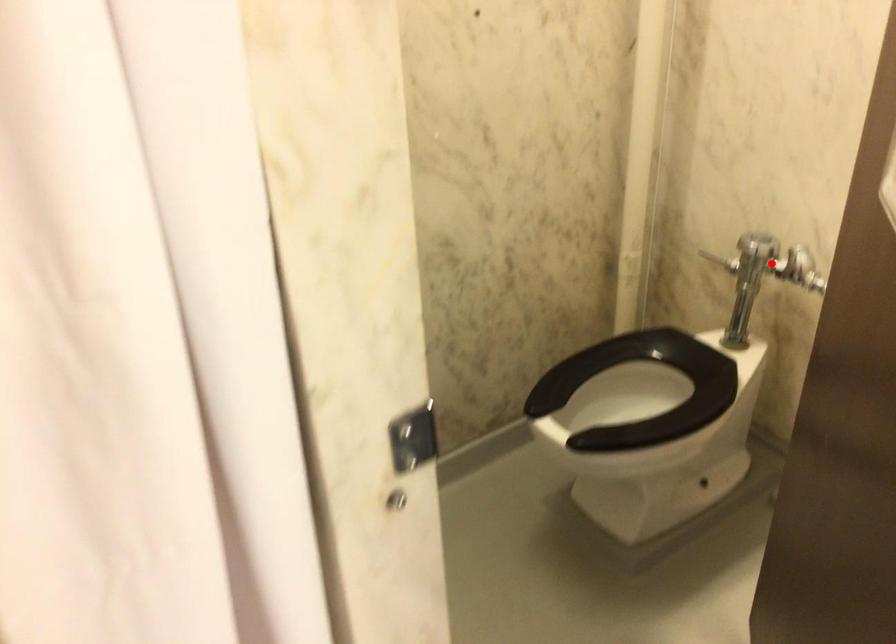
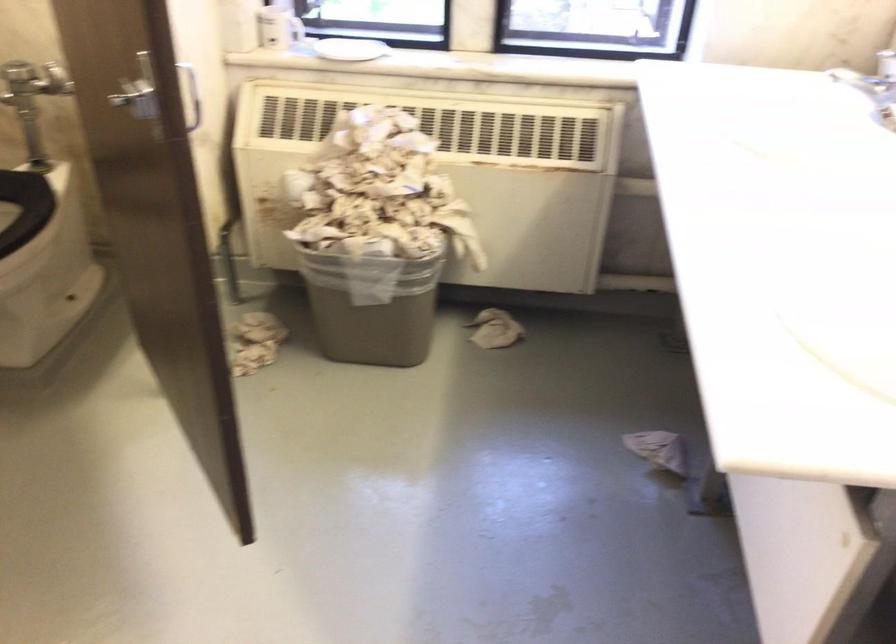
Question: I am providing you with two images of the same scene from different viewpoints. Image1 has a red point marked. In image2, the corresponding 3D location appears at what relative position? Reply with the corresponding letter.

Choices:
 (A) Closer
 (B) Farther

Answer: (B)